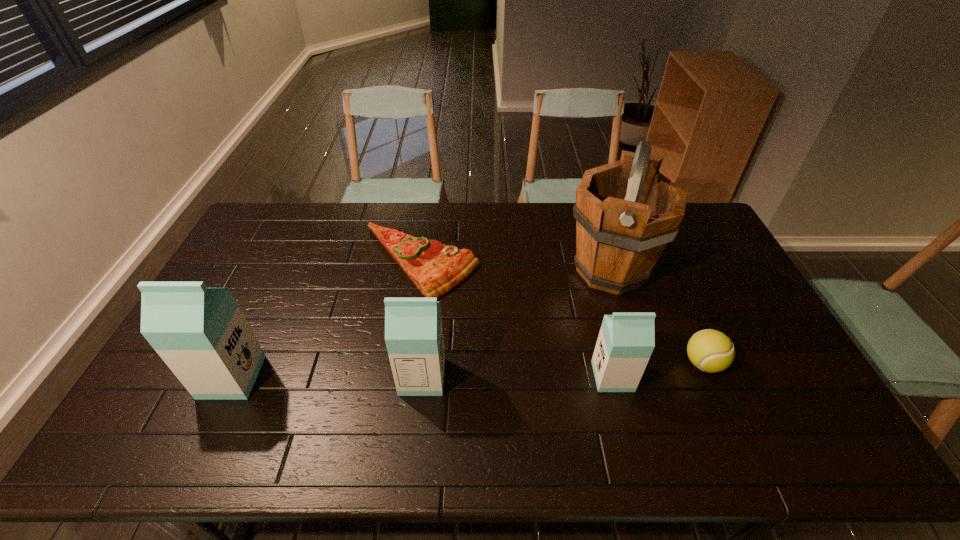
Where is `the leftmost object`? the leftmost object is located at coordinates (201, 334).

The width and height of the screenshot is (960, 540). I want to click on the second shortest milk carton, so click(413, 326).

Locate an element on the screen. The width and height of the screenshot is (960, 540). the second milk carton from right to left is located at coordinates (413, 326).

Locate an element on the screen. Image resolution: width=960 pixels, height=540 pixels. the shortest milk carton is located at coordinates (626, 340).

What are the coordinates of `the rightmost milk carton` in the screenshot? It's located at (626, 340).

At what (x,y) coordinates should I click in order to perform the action: click on bucket. Please return your answer as a coordinate pair (x, y). The width and height of the screenshot is (960, 540). Looking at the image, I should click on (626, 212).

Locate an element on the screen. Image resolution: width=960 pixels, height=540 pixels. pizza is located at coordinates (435, 268).

The image size is (960, 540). What are the coordinates of `tennis ball` in the screenshot? It's located at (712, 351).

Where is `vacant space located 0.270m on the back of the leftmost object`? The width and height of the screenshot is (960, 540). vacant space located 0.270m on the back of the leftmost object is located at coordinates (274, 287).

The width and height of the screenshot is (960, 540). In order to click on blank space located on the left of the second milk carton from left to right in this screenshot , I will do `click(288, 376)`.